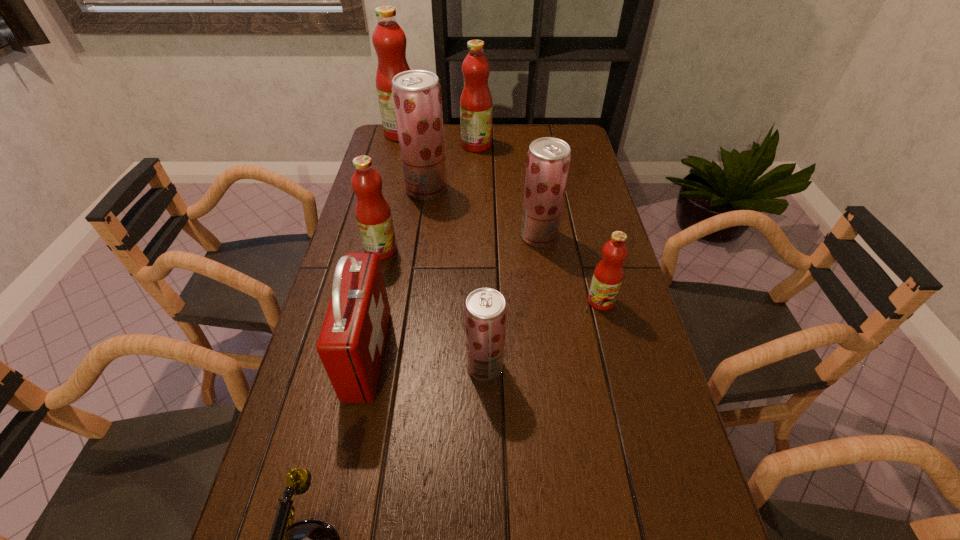
Where is `the tallest fruit juice`? the tallest fruit juice is located at coordinates tap(389, 40).

Where is `the tallest object`? the tallest object is located at coordinates (389, 40).

Where is `the third smallest pink fruit juice`? Image resolution: width=960 pixels, height=540 pixels. the third smallest pink fruit juice is located at coordinates (476, 106).

This screenshot has width=960, height=540. Identify the location of the biggest strawberry fruit juice. (417, 99).

Where is `the farthest strawberry fruit juice`? This screenshot has height=540, width=960. the farthest strawberry fruit juice is located at coordinates (417, 99).

This screenshot has width=960, height=540. Identify the location of the second biggest strawberry fruit juice. (548, 159).

Where is `the eighth object from left to right`? This screenshot has width=960, height=540. the eighth object from left to right is located at coordinates (548, 159).

This screenshot has width=960, height=540. Find the location of `the third farthest pink fruit juice`. the third farthest pink fruit juice is located at coordinates (373, 214).

Locate an element on the screen. the first-aid kit is located at coordinates (351, 342).

Identify the location of the second nearest fruit juice. (608, 274).